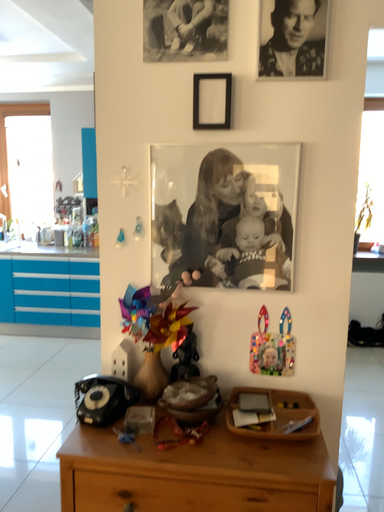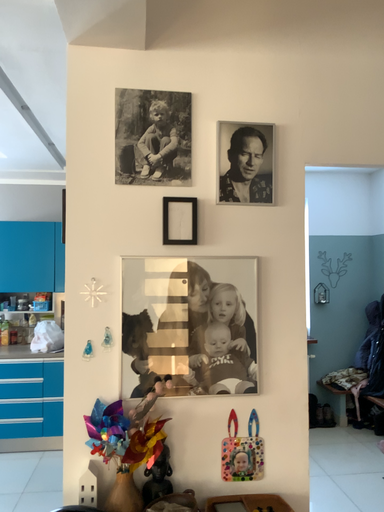
Question: Which way did the camera rotate in the video?

Choices:
 (A) rotated right
 (B) rotated left

Answer: (A)